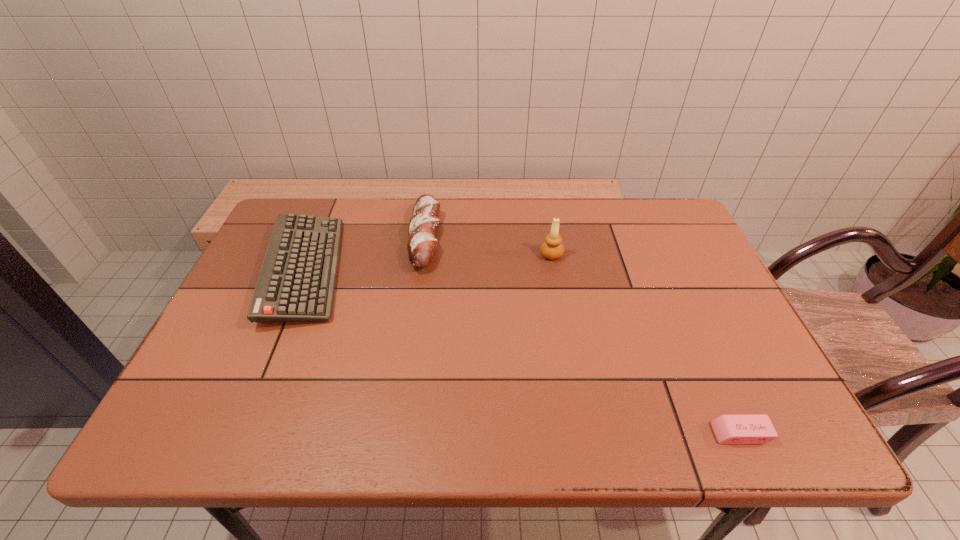
Find the location of `free point between the candle_holder and the shortest object`. free point between the candle_holder and the shortest object is located at coordinates (646, 344).

This screenshot has width=960, height=540. What are the coordinates of `object that is the second closest to the nearest object` in the screenshot? It's located at [x=423, y=225].

You are a GUI agent. You are given a task and a screenshot of the screen. Output one action in this format:
    pyautogui.click(x=<x>, y=<y>)
    Task: Click on the closest object to the baguet
    The height and width of the screenshot is (540, 960).
    Given the screenshot: What is the action you would take?
    pyautogui.click(x=297, y=280)

The height and width of the screenshot is (540, 960). Find the location of `free space that satisfies the following two spatial constraints: 1. on the front side of the second object from right to left; 2. on the left side of the second object from left to right`. free space that satisfies the following two spatial constraints: 1. on the front side of the second object from right to left; 2. on the left side of the second object from left to right is located at coordinates (422, 254).

The width and height of the screenshot is (960, 540). I want to click on vacant space that satisfies the following two spatial constraints: 1. on the back side of the third object from right to left; 2. on the left side of the leftmost object, so click(318, 237).

This screenshot has width=960, height=540. Identify the location of free space that satisfies the following two spatial constraints: 1. on the back side of the candle_holder; 2. on the left side of the computer keyboard. click(311, 254).